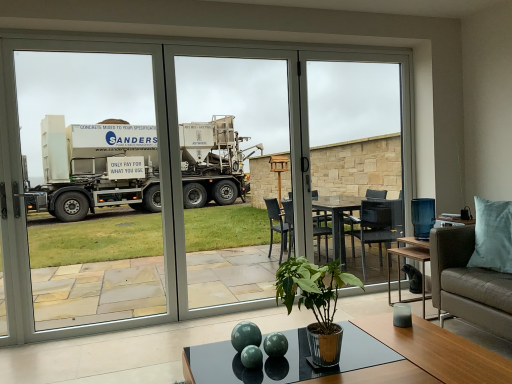
Identify the location of free space above transparent glass door at left, the 2th screen door in the right-to-left sequence (from a real-world perspective). (75, 41).